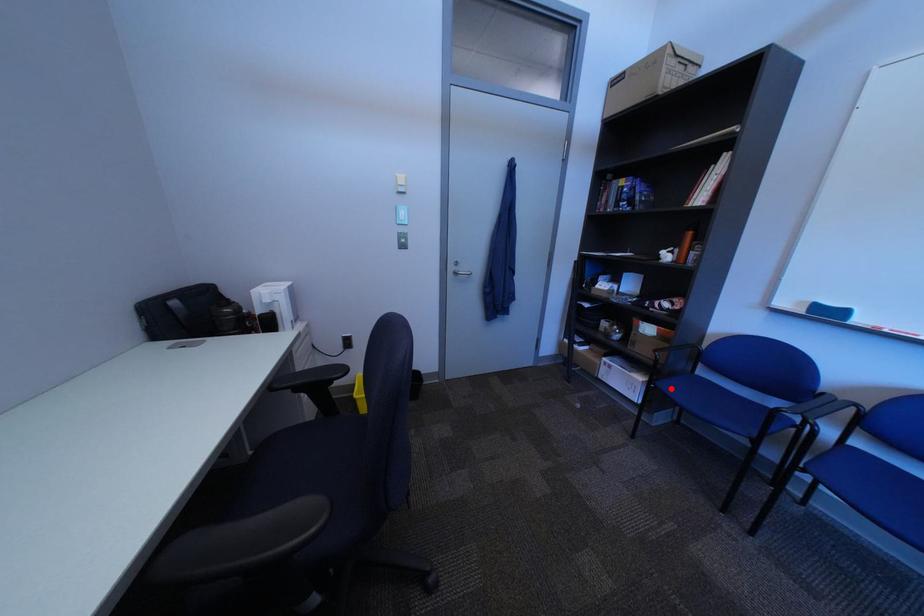
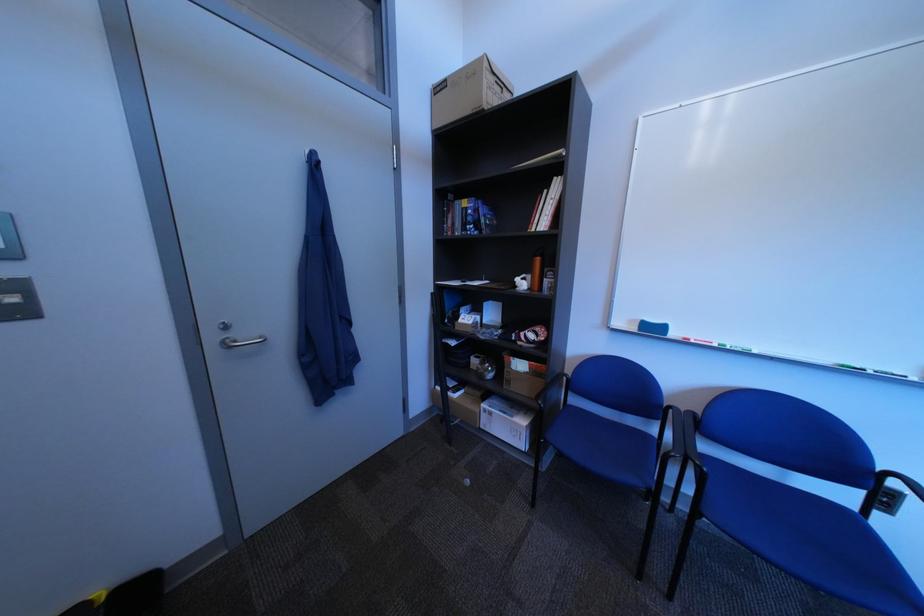
Find the pixel in the second image that matches the highlighted location in the first image.

(561, 442)